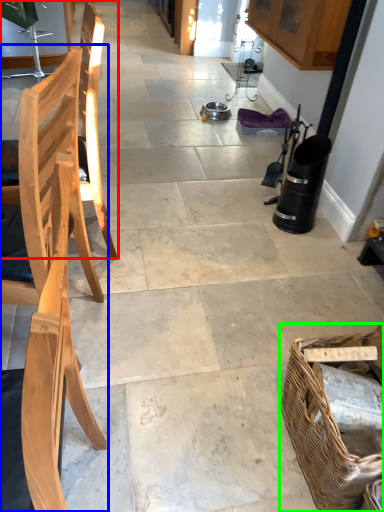
Question: Based on their relative distances, which object is farther from chair (highlighted by a red box)? Choose from chair (highlighted by a blue box) and picnic basket (highlighted by a green box).

Choices:
 (A) chair
 (B) picnic basket

Answer: (B)